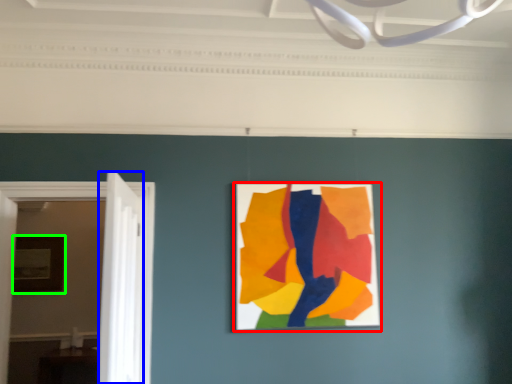
Question: Considering the real-world distances, which object is farthest from picture frame (highlighted by a red box)? door (highlighted by a blue box) or picture frame (highlighted by a green box)?

Choices:
 (A) door
 (B) picture frame

Answer: (B)